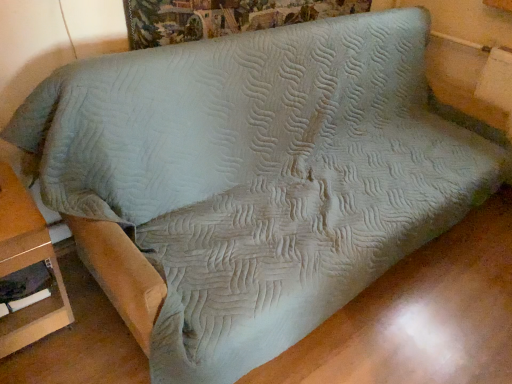
In order to click on wooden drawer at lower left in this screenshot , I will do (27, 266).

This screenshot has width=512, height=384. Describe the element at coordinates (27, 266) in the screenshot. I see `wooden drawer at lower left` at that location.

The image size is (512, 384). What are the coordinates of `wooden drawer at lower left` in the screenshot? It's located at (27, 266).